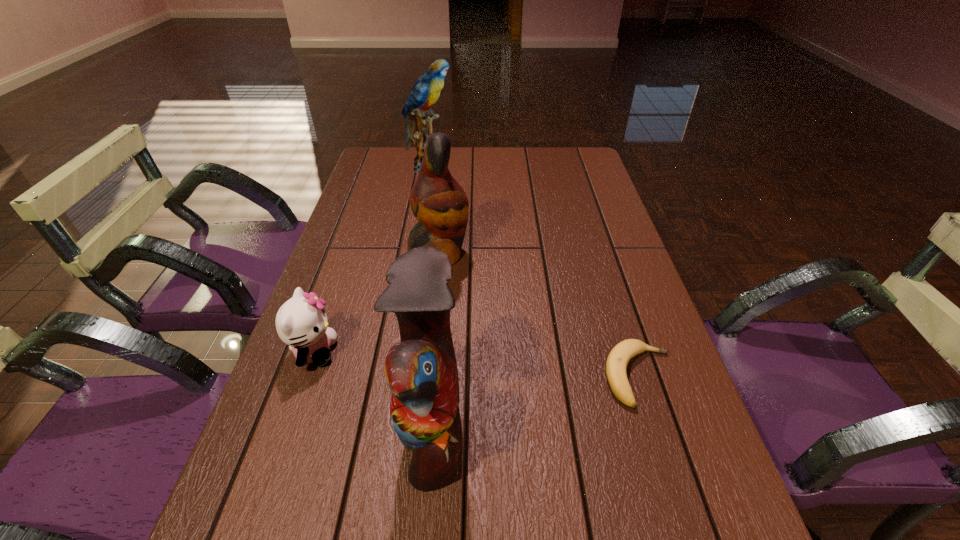
This screenshot has height=540, width=960. Find the location of `the farthest object`. the farthest object is located at coordinates (426, 91).

Where is `the second nearest parrot`? This screenshot has height=540, width=960. the second nearest parrot is located at coordinates (439, 203).

At what (x,y) coordinates should I click in order to perform the action: click on the nearest parrot. Please return your answer as a coordinate pair (x, y). The height and width of the screenshot is (540, 960). Looking at the image, I should click on (421, 371).

Locate an element on the screen. The height and width of the screenshot is (540, 960). the fourth tallest object is located at coordinates (301, 322).

Where is `kitten`? The image size is (960, 540). kitten is located at coordinates (301, 322).

Image resolution: width=960 pixels, height=540 pixels. What are the coordinates of `the shortest object` in the screenshot? It's located at (616, 365).

Where is `banana`? The width and height of the screenshot is (960, 540). banana is located at coordinates (616, 365).

You are a GUI agent. You are given a task and a screenshot of the screen. Output one action in this format:
    pyautogui.click(x=<x>, y=<y>)
    Task: Click on the free space located on the face of the farthest object
    
    Given the screenshot: What is the action you would take?
    pyautogui.click(x=489, y=166)

Locate an element on the screen. The image size is (960, 540). vacant space situated on the face of the second nearest parrot is located at coordinates (512, 255).

Find the location of a particular element. This screenshot has height=540, width=960. vacant space situated at the face of the nearest parrot is located at coordinates (557, 427).